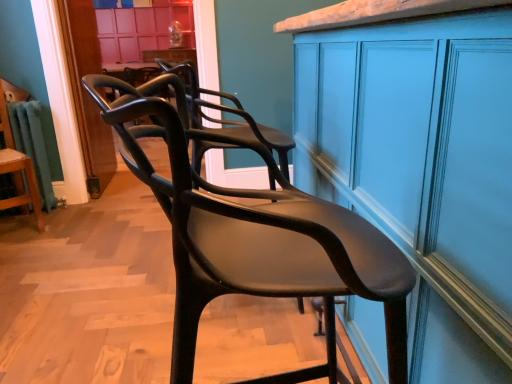
At what (x,y) coordinates should I click in order to perform the action: click on free spot to the right of matte black chair at left, which is counted as the first chair, starting from the left. Please return your answer as a coordinate pair (x, y). The width and height of the screenshot is (512, 384). Looking at the image, I should click on (63, 221).